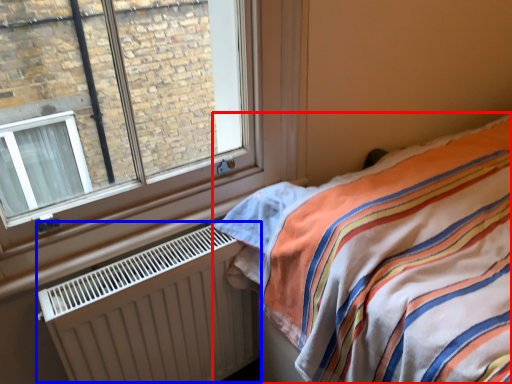
Question: Which object is closer to the camera taking this photo, bed (highlighted by a red box) or radiator (highlighted by a blue box)?

Choices:
 (A) bed
 (B) radiator

Answer: (A)